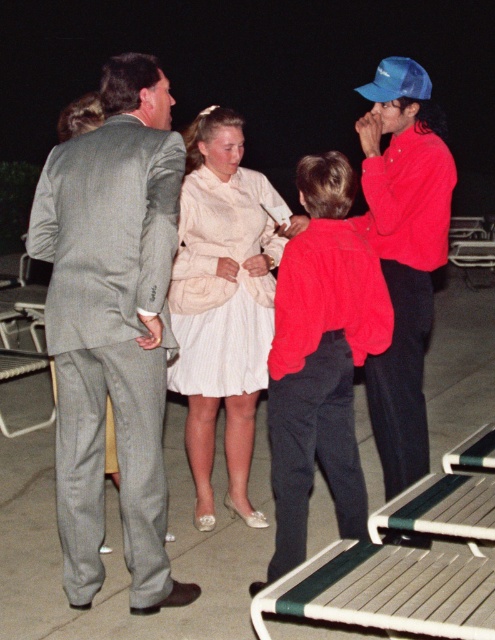
Question: From the image, what is the correct spatial relationship of gray pinstripe suit at left in relation to red fuzzy sweater at center?

Choices:
 (A) below
 (B) above

Answer: (B)

Question: Which object is closer to the camera taking this photo?

Choices:
 (A) gray pinstripe suit at left
 (B) white striped fabric dress at center
 (C) red fuzzy sweater at center
 (D) shiny red jacket at right

Answer: (A)

Question: Does shiny red jacket at right have a larger size compared to blue matte baseball cap at upper right?

Choices:
 (A) no
 (B) yes

Answer: (B)

Question: Based on their relative distances, which object is farther from the gray pinstripe suit at left?

Choices:
 (A) red fuzzy sweater at center
 (B) blue matte baseball cap at upper right

Answer: (B)

Question: Which point is closer to the camera taking this photo?

Choices:
 (A) (448, 202)
 (B) (385, 58)

Answer: (A)

Question: Can you confirm if red fuzzy sweater at center is bigger than shiny red jacket at right?

Choices:
 (A) no
 (B) yes

Answer: (A)